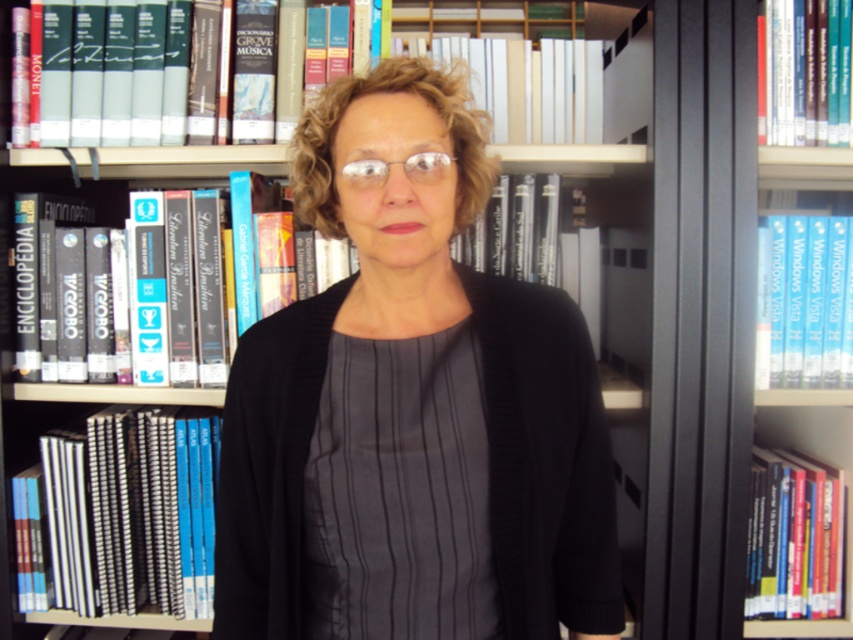
Question: Is white paper book at upper center bigger than clear plastic glasses at center?

Choices:
 (A) no
 (B) yes

Answer: (B)

Question: Which object appears farthest from the camera in this image?

Choices:
 (A) black hardcover books at left
 (B) black matte sweater at center
 (C) hardcover book at upper right
 (D) hardcover book at center

Answer: (A)

Question: Does hardcover book at right have a lesser width compared to hardcover book at center?

Choices:
 (A) no
 (B) yes

Answer: (B)

Question: Considering the real-world distances, which object is closest to the white paper book at upper center?

Choices:
 (A) black hardcover books at left
 (B) blue hardcover book at right
 (C) black matte sweater at center
 (D) hardcover book at center

Answer: (B)

Question: Estimate the real-world distances between objects in this image. Which object is farther from the blue hardcover book at right?

Choices:
 (A) black hardcover books at left
 (B) hardcover book at right

Answer: (A)

Question: Does blue hardcover book at right have a smaller size compared to white paper book at upper center?

Choices:
 (A) no
 (B) yes

Answer: (B)